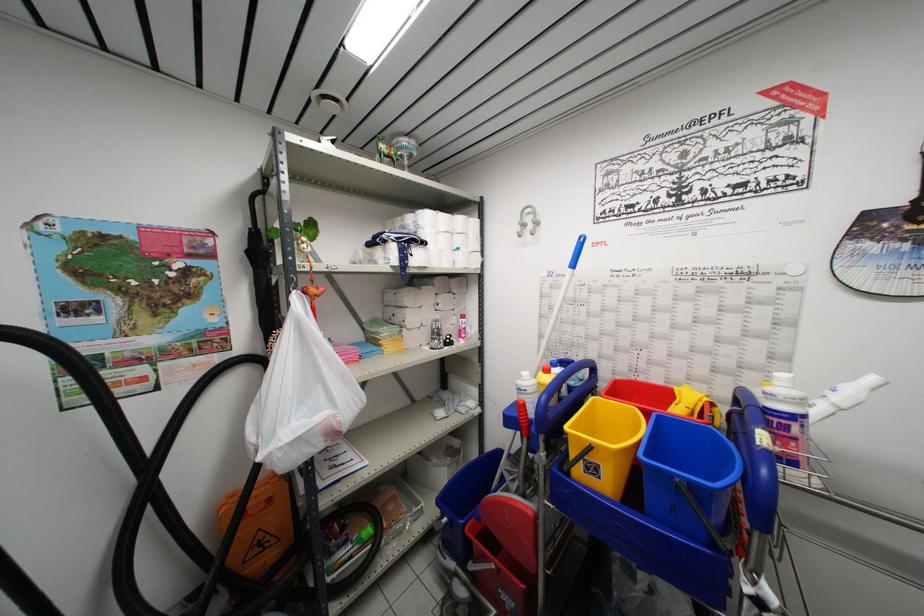
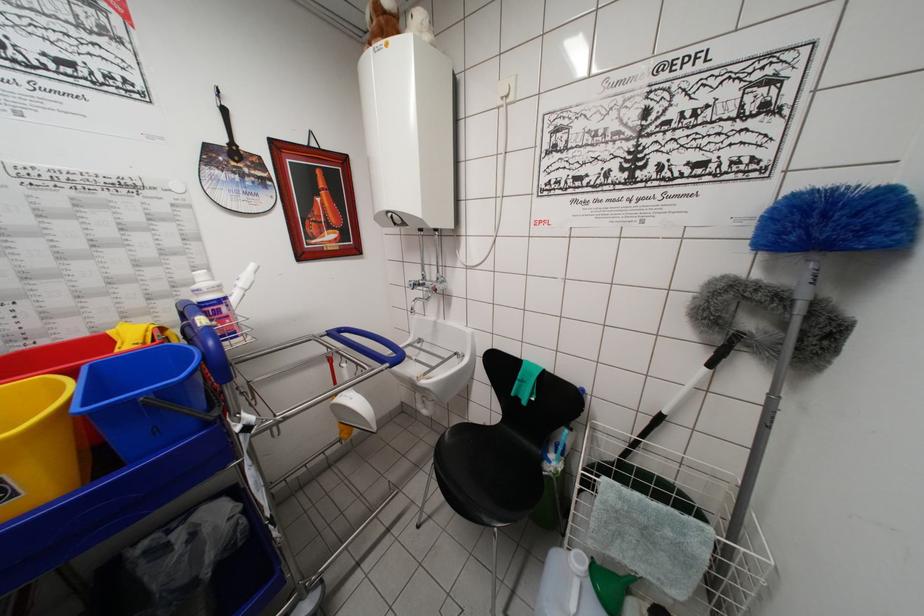
In the second image, find the point that corresponds to (x=675, y=479) in the first image.

(136, 405)